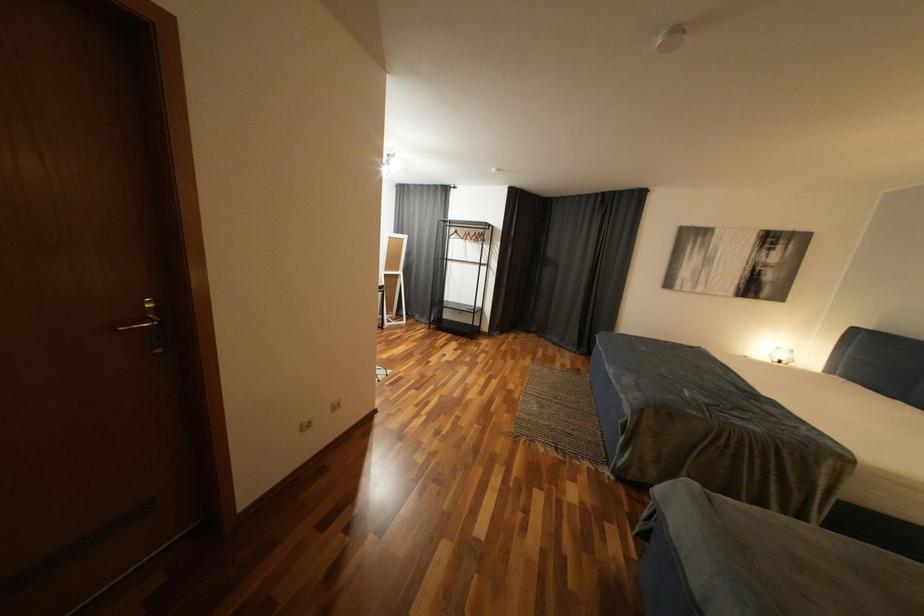
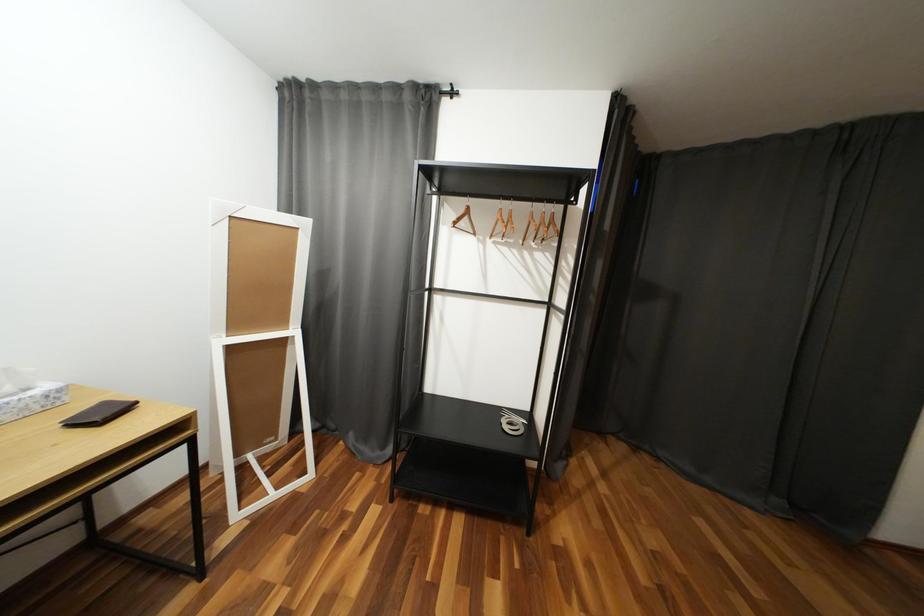
Question: Which direction would the cameraman need to move to produce the second image? Reply with the corresponding letter.

Choices:
 (A) Left
 (B) Right
 (C) Forward
 (D) Backward

Answer: (C)